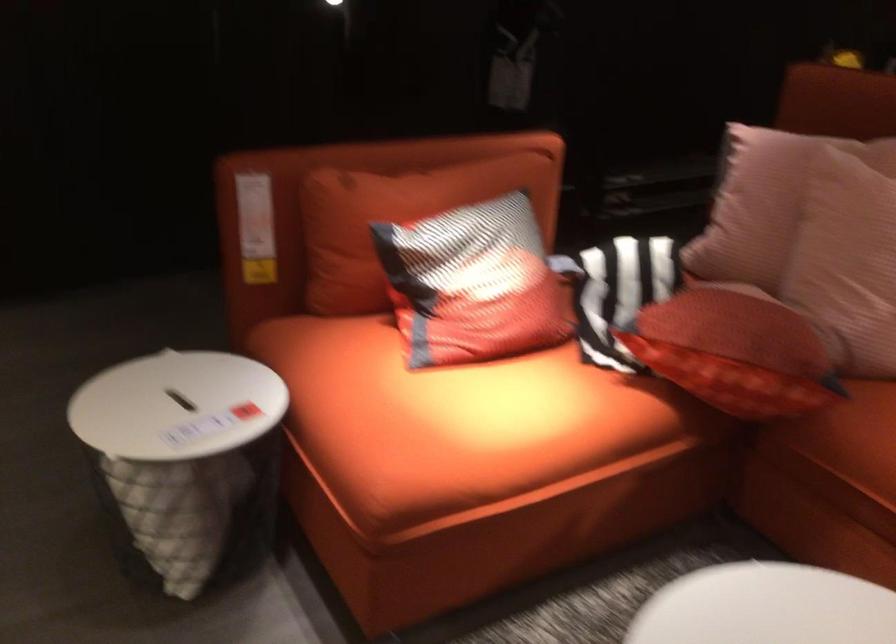
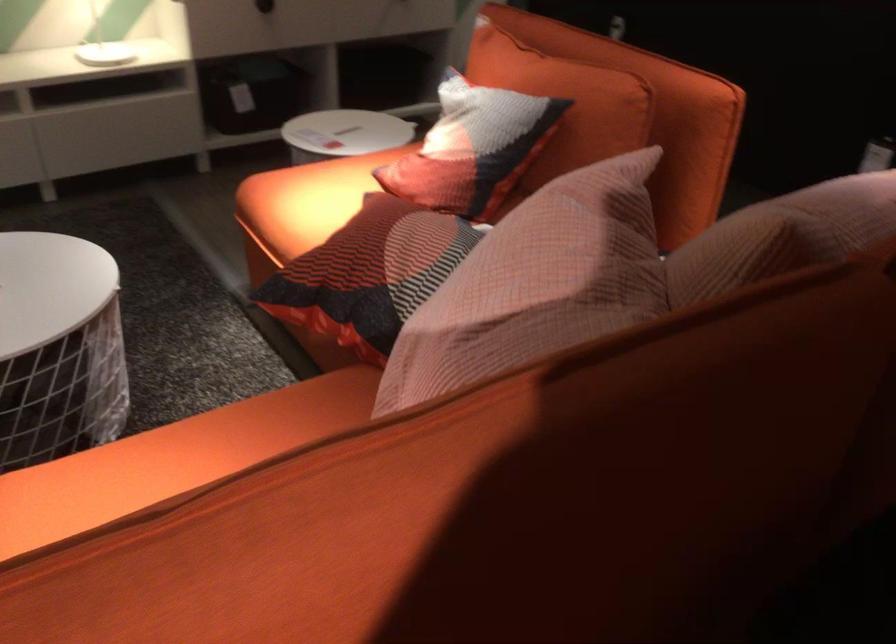
In the second image, find the point that corresponds to the point at 593,533 in the first image.

(322, 348)